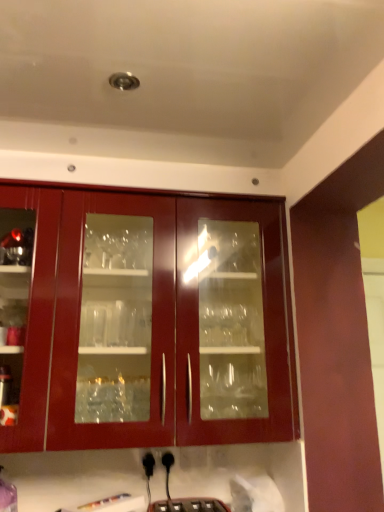
At what (x,y) coordinates should I click in order to perform the action: click on glossy wood cabinet at upper center. Please return your answer as a coordinate pair (x, y). The height and width of the screenshot is (512, 384). Looking at the image, I should click on (168, 321).

Describe the element at coordinates (168, 321) in the screenshot. I see `glossy wood cabinet at upper center` at that location.

Image resolution: width=384 pixels, height=512 pixels. What are the coordinates of `glossy wood cabinet at upper center` in the screenshot? It's located at (168, 321).